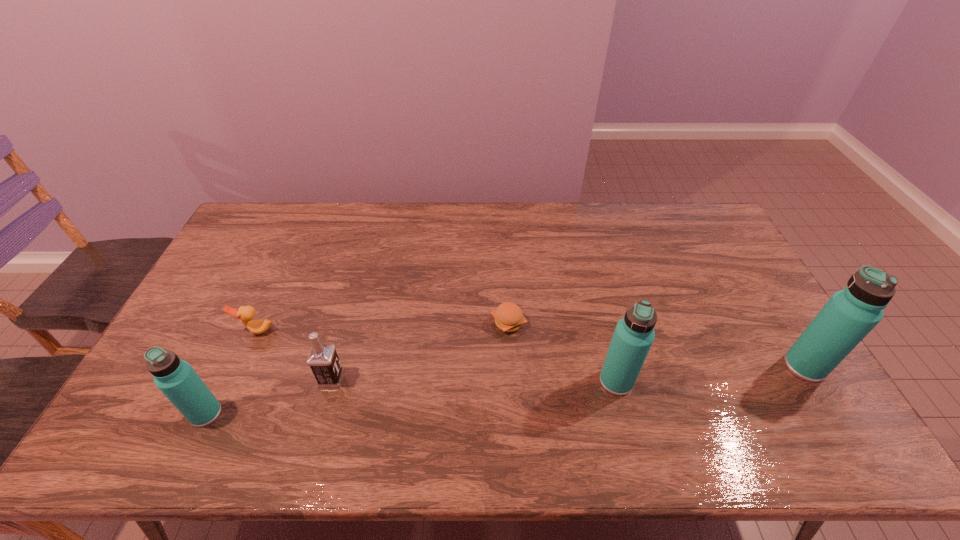
Find the location of a particular element. free location located 0.370m on the right of the leftmost thermos bottle is located at coordinates (368, 414).

Image resolution: width=960 pixels, height=540 pixels. I want to click on vacant space located 0.050m on the front of the second thermos bottle from right to left, so (x=624, y=414).

Where is `vacant space located 0.260m on the left of the rightmost object`? This screenshot has height=540, width=960. vacant space located 0.260m on the left of the rightmost object is located at coordinates (690, 366).

Where is `vacant space located on the front label of the third shortest object`? vacant space located on the front label of the third shortest object is located at coordinates (447, 378).

Locate an element on the screen. The width and height of the screenshot is (960, 540). free space located 0.230m on the left of the fourth object from left to right is located at coordinates (414, 323).

Where is `free point located 0.170m on the beak of the fifth tallest object`? Image resolution: width=960 pixels, height=540 pixels. free point located 0.170m on the beak of the fifth tallest object is located at coordinates (230, 389).

Find the location of a particular element. Image resolution: width=960 pixels, height=540 pixels. vodka present at the near edge is located at coordinates (323, 360).

At what (x,y) coordinates should I click in order to perform the action: click on object at the left edge. Please return your answer as a coordinate pair (x, y). Looking at the image, I should click on (176, 379).

Where is `object at the right edge`? The image size is (960, 540). object at the right edge is located at coordinates (849, 315).

Where is `object that is at the near left corner`? Image resolution: width=960 pixels, height=540 pixels. object that is at the near left corner is located at coordinates (176, 379).